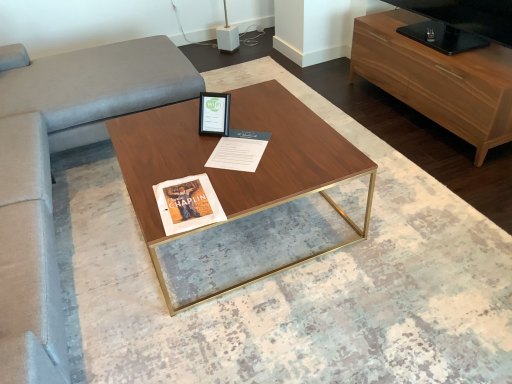
Find the location of a particular element. This screenshot has width=512, height=384. vacant space situated on the left part of matte black picture frame at center is located at coordinates (174, 130).